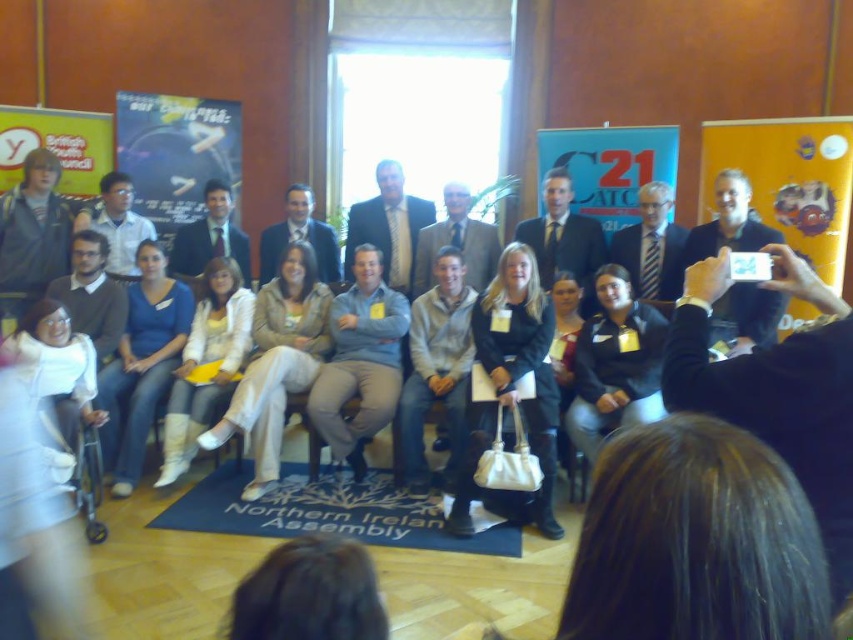
Question: Observing the image, what is the correct spatial positioning of yellow paper at right in reference to denim jeans at center?

Choices:
 (A) above
 (B) below

Answer: (A)

Question: Is gray fleece jacket at center behind matte black suit at upper center?

Choices:
 (A) no
 (B) yes

Answer: (A)

Question: Among these objects, which one is nearest to the camera?

Choices:
 (A) denim jeans at center
 (B) blue fabric banner at center

Answer: (A)

Question: Considering the relative positions of yellow paper at right and black leather jacket at center in the image provided, where is yellow paper at right located with respect to black leather jacket at center?

Choices:
 (A) left
 (B) right

Answer: (B)

Question: Which of these objects is positioned closest to the denim jeans at center?

Choices:
 (A) blue fabric banner at center
 (B) light brown suit at center
 (C) matte gray suit at center

Answer: (C)

Question: Which object appears farthest from the camera in this image?

Choices:
 (A) black leather jacket at center
 (B) blue fabric banner at center
 (C) gray cotton shirt at center

Answer: (B)